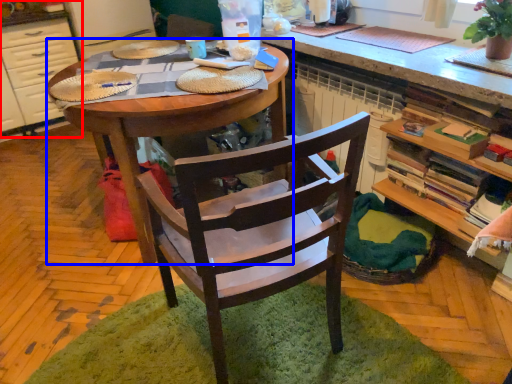
Question: Among these objects, which one is farthest to the camera, cabinetry (highlighted by a red box) or desk (highlighted by a blue box)?

Choices:
 (A) cabinetry
 (B) desk

Answer: (A)